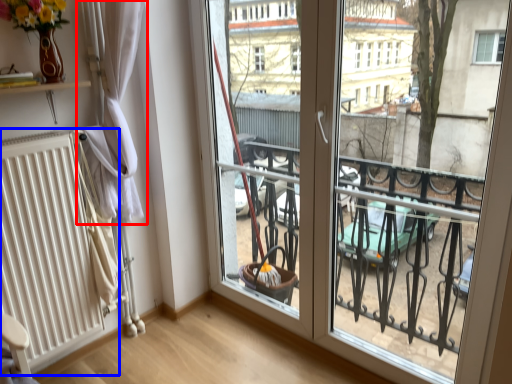
Question: Among these objects, which one is nearest to the camera, curtain (highlighted by a red box) or radiator (highlighted by a blue box)?

Choices:
 (A) curtain
 (B) radiator

Answer: (B)